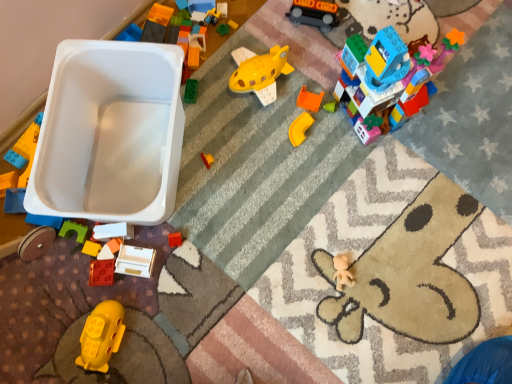
What are the coordinates of `vacant space that's between yellow matte plastic corner piece at center-right, acting as the third toy starting from the right, and shiny black train at upper center, which ranks as the 2th toy in right-to-left order` in the screenshot? It's located at (304, 74).